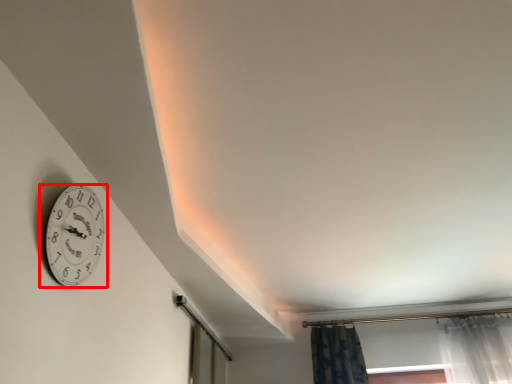
Question: From the image's perspective, what is the correct spatial relationship of wall clock (annotated by the red box) in relation to glass door?

Choices:
 (A) below
 (B) above

Answer: (B)